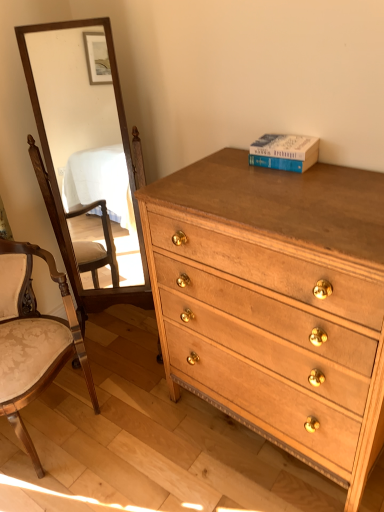
Identify the location of vacant area to the left of light brown wood chest of drawers at center. (157, 444).